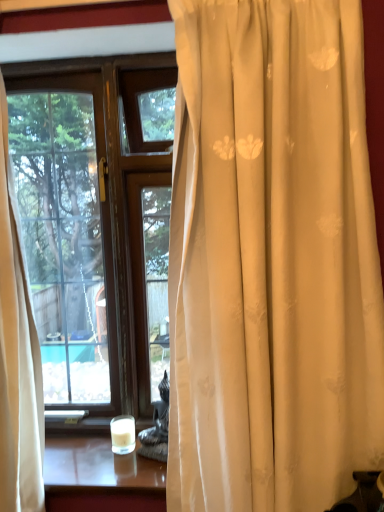
At what (x,y) coordinates should I click in order to perform the action: click on vacant position to the left of black textured statue at lower center. Please return your answer as a coordinate pair (x, y). This screenshot has height=512, width=384. Looking at the image, I should click on (103, 468).